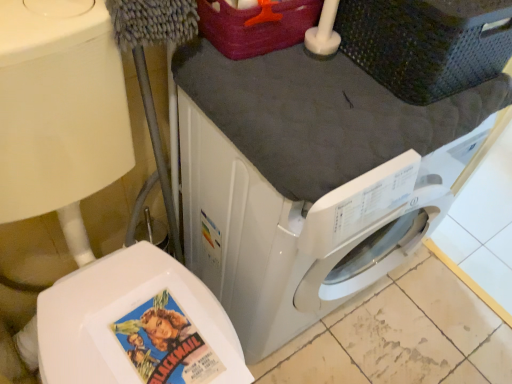
Question: Is dark gray plastic basket at upper right touching white glossy washing machine at center?

Choices:
 (A) yes
 (B) no

Answer: (B)

Question: Could you tell me if dark gray plastic basket at upper right is turned towards white glossy washing machine at center?

Choices:
 (A) no
 (B) yes

Answer: (A)

Question: Are dark gray plastic basket at upper right and white glossy washing machine at center far apart?

Choices:
 (A) yes
 (B) no

Answer: (B)

Question: Is dark gray plastic basket at upper right in front of white glossy washing machine at center?

Choices:
 (A) no
 (B) yes

Answer: (A)

Question: Is dark gray plastic basket at upper right positioned with its back to white glossy washing machine at center?

Choices:
 (A) yes
 (B) no

Answer: (B)

Question: Considering the relative sizes of dark gray plastic basket at upper right and white glossy washing machine at center in the image provided, is dark gray plastic basket at upper right smaller than white glossy washing machine at center?

Choices:
 (A) no
 (B) yes

Answer: (B)

Question: Is white glossy washing machine at center directly adjacent to dark gray plastic basket at upper right?

Choices:
 (A) yes
 (B) no

Answer: (B)

Question: Considering the relative sizes of white glossy washing machine at center and dark gray plastic basket at upper right in the image provided, is white glossy washing machine at center wider than dark gray plastic basket at upper right?

Choices:
 (A) no
 (B) yes

Answer: (B)

Question: Does white glossy washing machine at center have a lesser height compared to dark gray plastic basket at upper right?

Choices:
 (A) no
 (B) yes

Answer: (A)

Question: Can you confirm if white glossy washing machine at center is positioned to the left of dark gray plastic basket at upper right?

Choices:
 (A) yes
 (B) no

Answer: (A)

Question: Considering the relative sizes of white glossy washing machine at center and dark gray plastic basket at upper right in the image provided, is white glossy washing machine at center taller than dark gray plastic basket at upper right?

Choices:
 (A) no
 (B) yes

Answer: (B)

Question: Is dark gray plastic basket at upper right at the back of white glossy washing machine at center?

Choices:
 (A) yes
 (B) no

Answer: (B)

Question: Does matte paper comic book at lower left have a larger size compared to dark gray plastic basket at upper right?

Choices:
 (A) yes
 (B) no

Answer: (B)